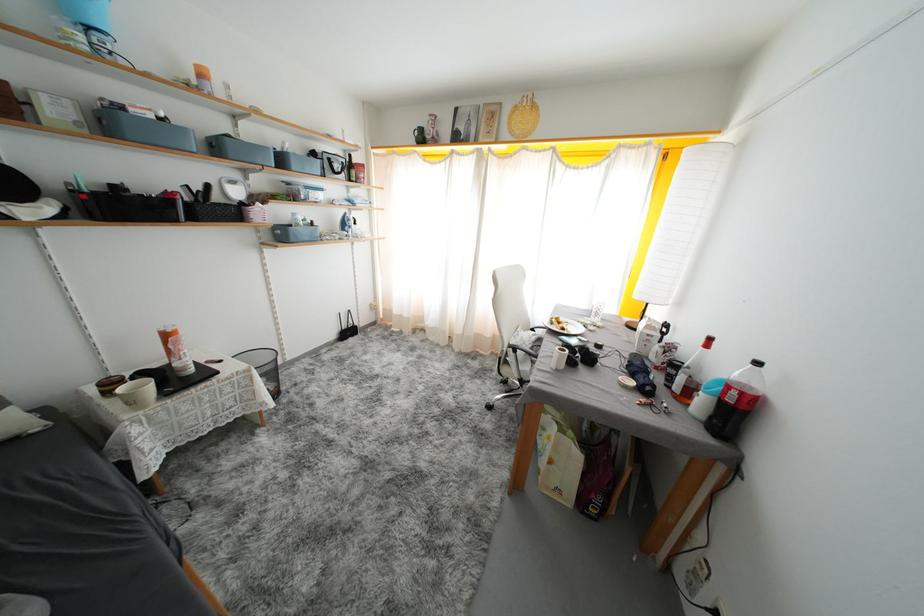
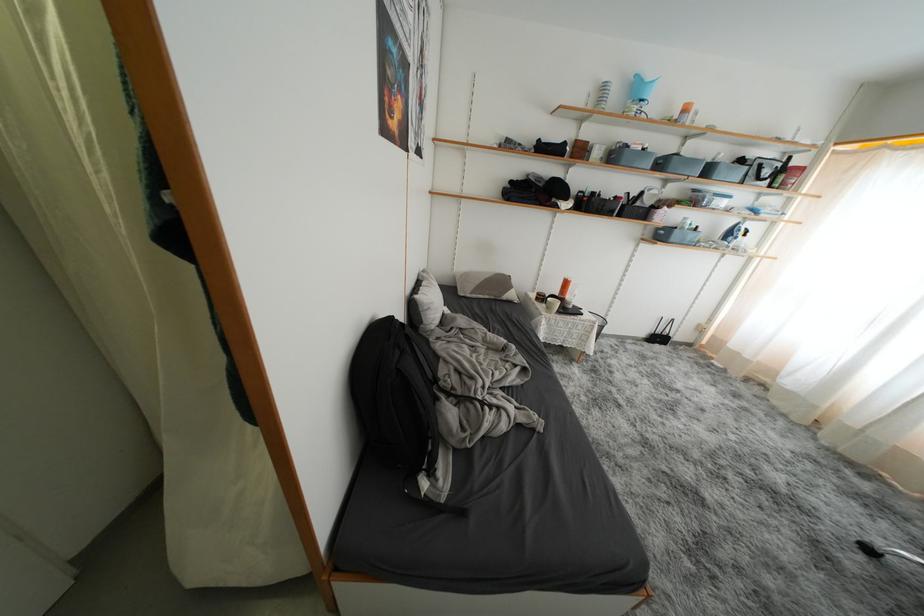
In the second image, find the point that corresponds to (x=74, y=107) in the first image.

(610, 152)